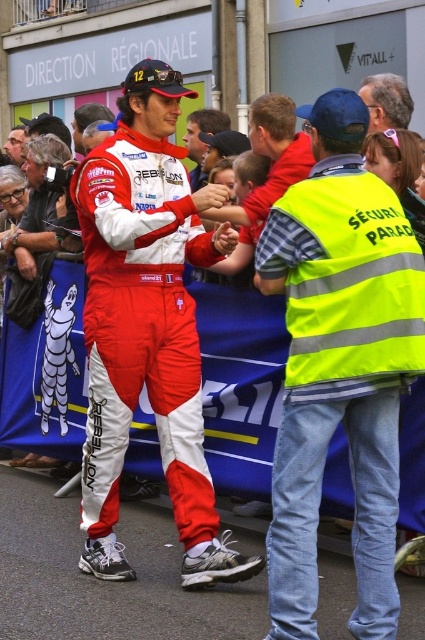
Looking at this image, you are a photographer at the event and want to capture a clear shot of the neon yellow reflective vest at center and the white synthetic sneakers at lower center. Which object should you focus on first to ensure both are in focus?

The neon yellow reflective vest at center is closer to the viewer than the white synthetic sneakers at lower center. To ensure both are in focus, focus on the neon yellow reflective vest at center first since it is closer, and the depth of field will extend to the farther object.

You are a photographer at the motorsport event and want to capture a photo of the neon yellow reflective vest at center and the matte red racing suit at center. Which object should you zoom in on to ensure both are clearly visible in the frame?

The neon yellow reflective vest at center has a lesser width compared to matte red racing suit at center. To ensure both are clearly visible, you should zoom in on the matte red racing suit at center since it is wider and will take up more space in the frame.

You are a photographer at the event and need to capture a closeup of the central figure. The neon yellow reflective vest at center and white synthetic sneakers at lower center are both in the frame. Which object is smaller in the photo?

The neon yellow reflective vest at center is smaller compared to the white synthetic sneakers at lower center in the photo.